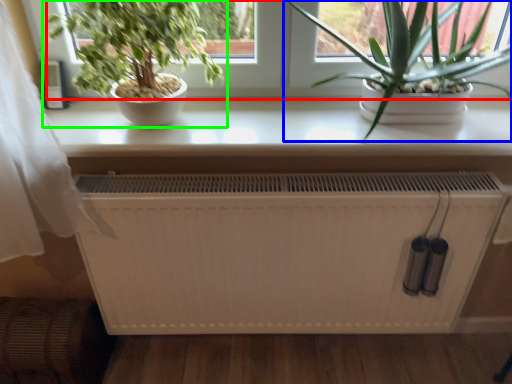
Question: Which object is positioned closest to window screen (highlighted by a red box)? Select from houseplant (highlighted by a blue box) and houseplant (highlighted by a green box).

Choices:
 (A) houseplant
 (B) houseplant

Answer: (A)